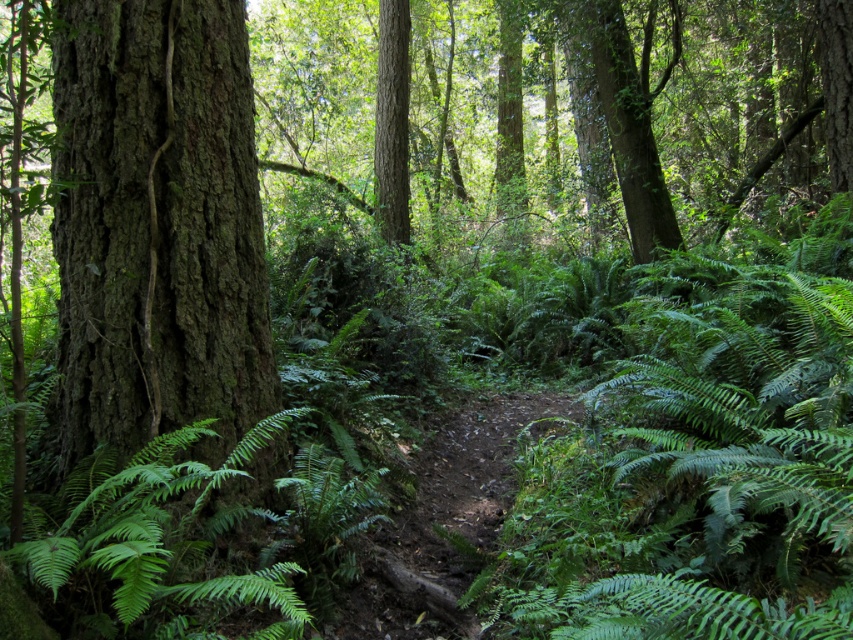
Does green rough bark tree at left appear under smooth bark tree at center?

Correct, green rough bark tree at left is located below smooth bark tree at center.

Is green rough bark tree at left behind smooth bark tree at center?

No, green rough bark tree at left is closer to the viewer.

Who is more forward, (227, 372) or (405, 218)?

Point (227, 372) is more forward.

I want to click on green rough bark tree at left, so click(157, 225).